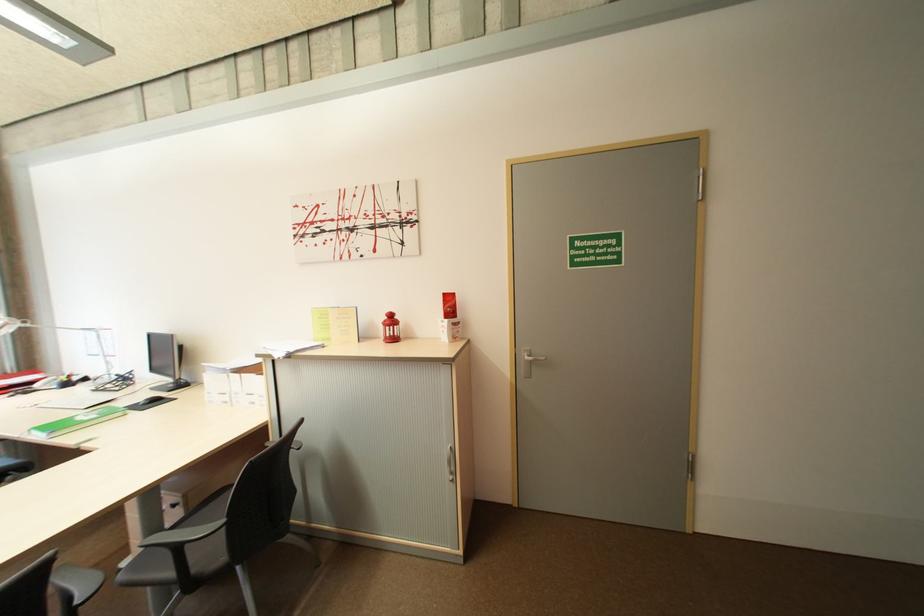
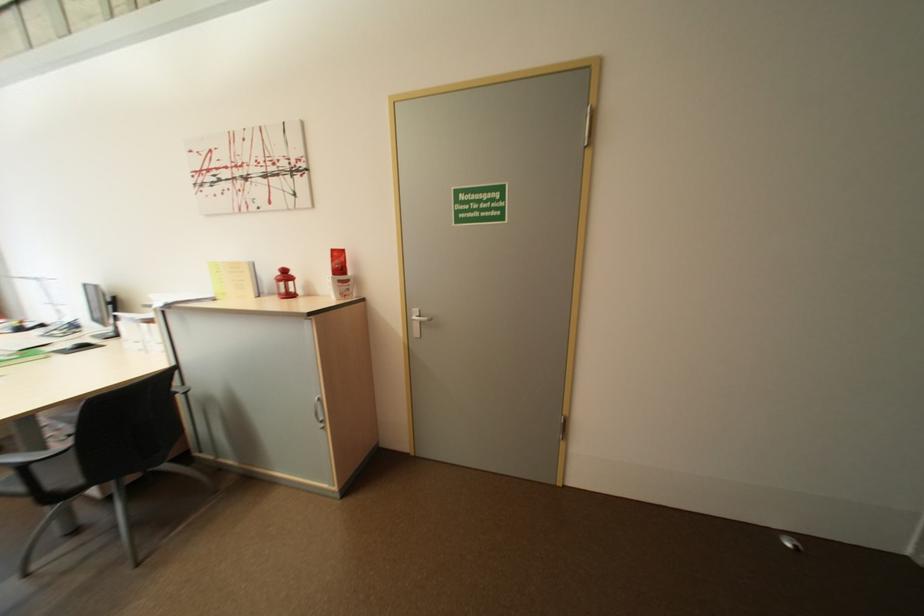
Find the pixel in the second image that matches point (395, 326) in the first image.

(286, 282)